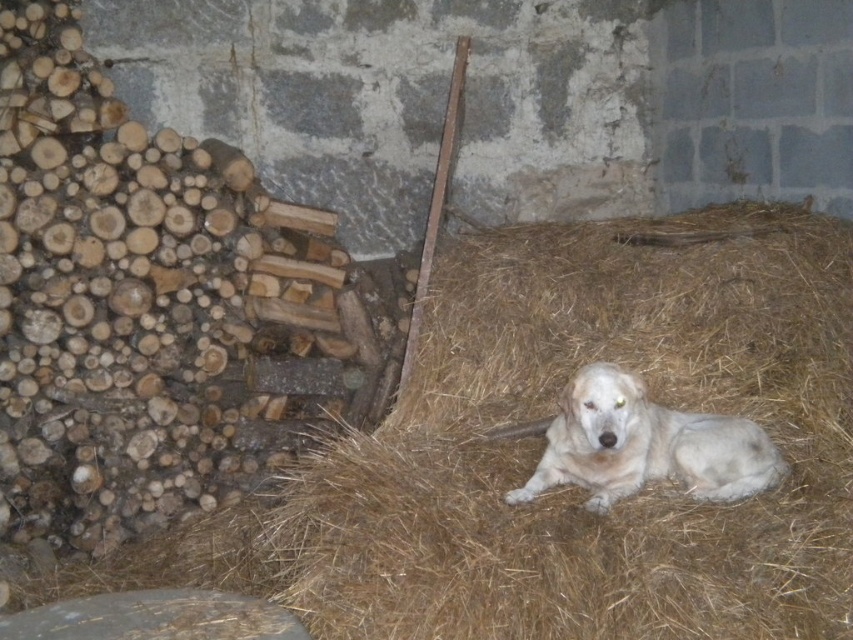
Where is `brown straw at center`? brown straw at center is located at coordinates (541, 449).

Between brown straw at center and white fur dog at center, which one is positioned lower?

brown straw at center

Which is behind, point (810, 512) or point (637, 476)?

The point (637, 476) is behind.

In order to click on brown straw at center in this screenshot , I will do click(541, 449).